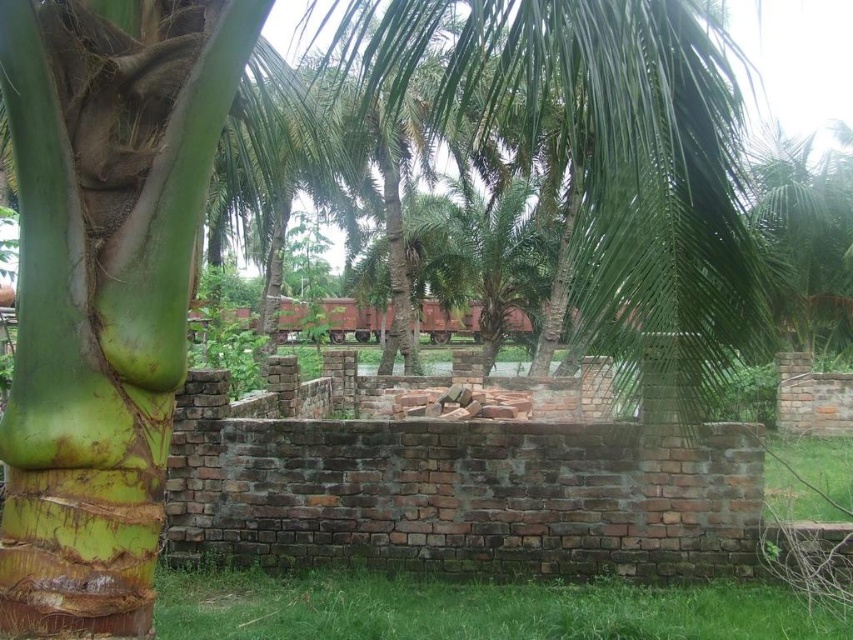
Is green grass at lower center to the left of green leafy palm tree at center from the viewer's perspective?

Indeed, green grass at lower center is positioned on the left side of green leafy palm tree at center.

Is green grass at lower center in front of green leafy palm tree at center?

Yes, green grass at lower center is in front of green leafy palm tree at center.

Is point (511, 586) positioned behind point (505, 236)?

No, (511, 586) is closer to viewer.

What are the coordinates of `green grass at lower center` in the screenshot? It's located at (474, 609).